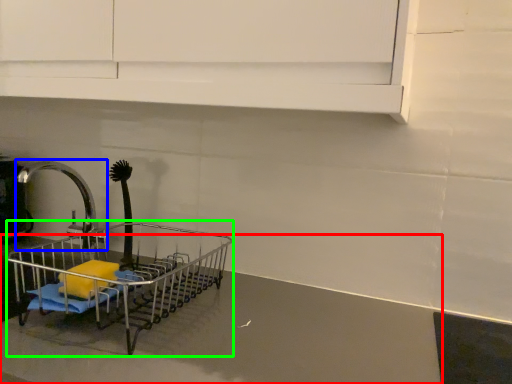
Question: Considering the real-world distances, which object is closest to counter top (highlighted by a red box)? tap (highlighted by a blue box) or shopping cart (highlighted by a green box).

Choices:
 (A) tap
 (B) shopping cart

Answer: (B)